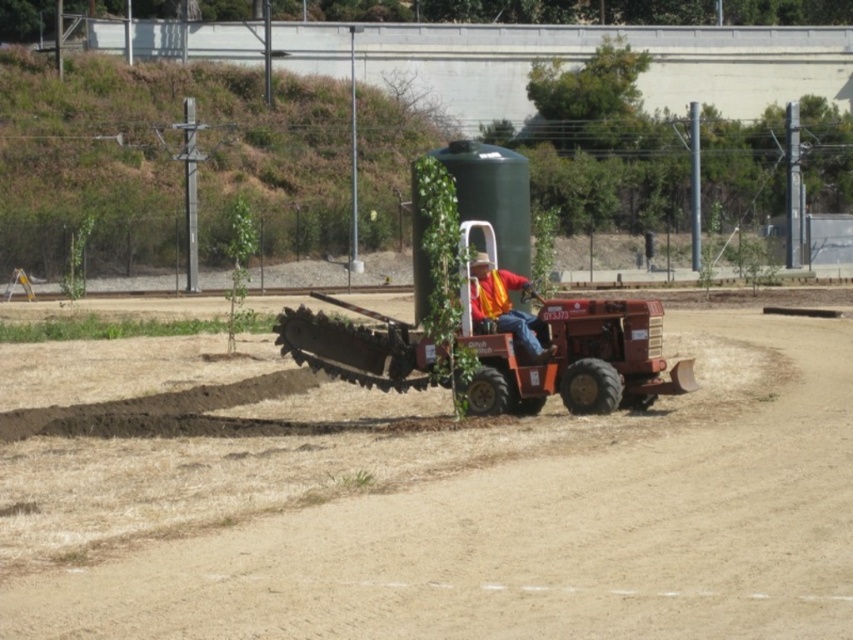
Question: Which of the following is the farthest from the observer?

Choices:
 (A) (379, 554)
 (B) (538, 358)

Answer: (B)

Question: Is brown dry soil at center bigger than orange reflective vest at center?

Choices:
 (A) no
 (B) yes

Answer: (B)

Question: Observing the image, what is the correct spatial positioning of green matte water tank at center in reference to orange reflective vest at center?

Choices:
 (A) right
 (B) left

Answer: (B)

Question: From the image, what is the correct spatial relationship of brown dry soil at center in relation to matte orange tractor at center?

Choices:
 (A) below
 (B) above

Answer: (A)

Question: Which object is closer to the camera taking this photo?

Choices:
 (A) matte orange tractor at center
 (B) green matte water tank at center
 (C) brown dry soil at center

Answer: (C)

Question: Which of the following is the closest to the observer?

Choices:
 (A) brown dry soil at center
 (B) orange reflective vest at center

Answer: (A)